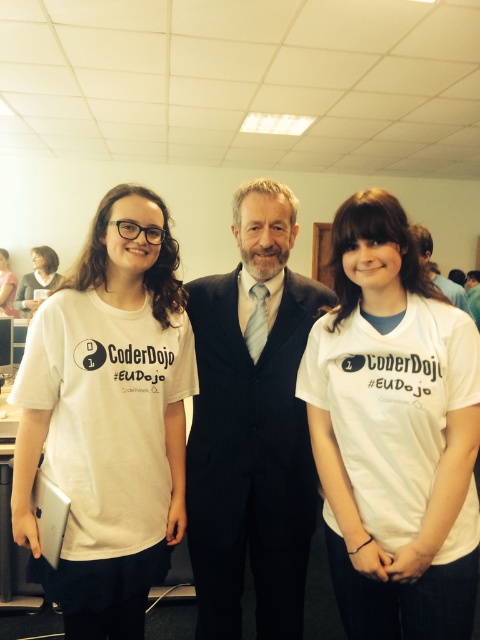
You are taking a photo of the three people in the scene. You want to focus on the point closer to the camera between the two points labeled as point (14, 449) and point (435, 275). Which point should you focus on?

You should focus on point (14, 449) because it is closer to the camera than point (435, 275).